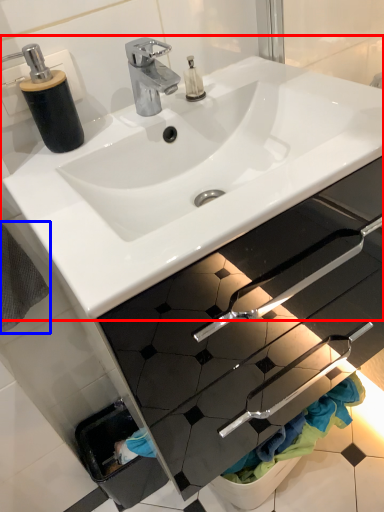
Question: Which of the following is the farthest to the observer, sink (highlighted by a red box) or bath towel (highlighted by a blue box)?

Choices:
 (A) sink
 (B) bath towel

Answer: (B)